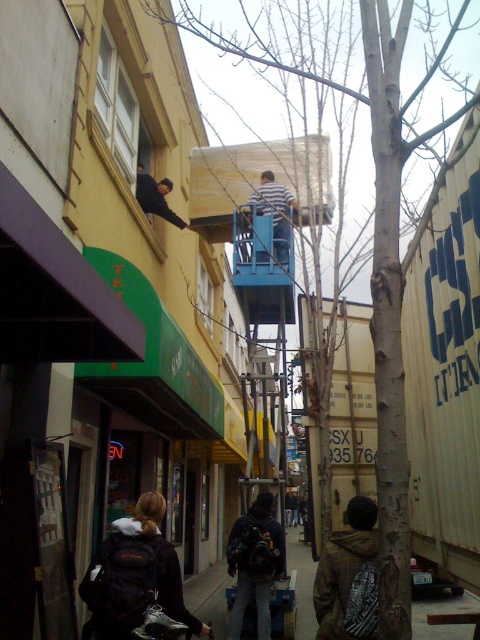
Question: Considering the real-world distances, which object is closest to the concrete sidewalk at lower center?

Choices:
 (A) striped shirt at center
 (B) black backpack at lower left
 (C) dark blue backpack at center

Answer: (C)

Question: Does concrete sidewalk at lower center have a greater width compared to dark blue jeans at upper left?

Choices:
 (A) no
 (B) yes

Answer: (B)

Question: Which of the following is the closest to the observer?

Choices:
 (A) (260, 618)
 (B) (147, 564)

Answer: (B)

Question: Is concrete sidewalk at lower center to the left of dark blue jeans at upper left from the viewer's perspective?

Choices:
 (A) yes
 (B) no

Answer: (B)

Question: Can you confirm if dark blue backpack at center is bigger than striped shirt at center?

Choices:
 (A) yes
 (B) no

Answer: (B)

Question: Among these points, which one is farthest from the camera?

Choices:
 (A) (123, 580)
 (B) (220, 563)

Answer: (B)